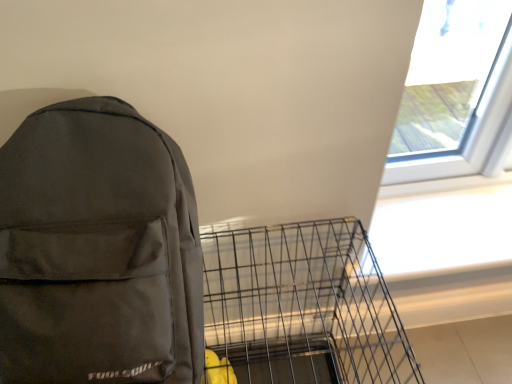
Question: Is point (436, 21) closer or farther from the camera than point (402, 370)?

Choices:
 (A) farther
 (B) closer

Answer: (B)

Question: In terms of width, does transparent glass window at upper right look wider or thinner when compared to metallic wire birdcage at lower center?

Choices:
 (A) thin
 (B) wide

Answer: (A)

Question: Which of these objects is positioned closest to the metallic wire birdcage at lower center?

Choices:
 (A) matte black backpack at left
 (B) transparent glass window at upper right

Answer: (A)

Question: Based on their relative distances, which object is farther from the metallic wire birdcage at lower center?

Choices:
 (A) transparent glass window at upper right
 (B) matte black backpack at left

Answer: (A)